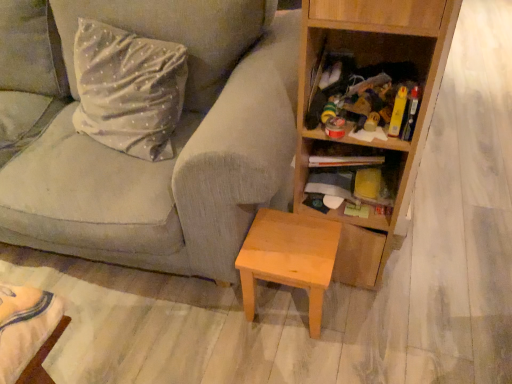
Question: Does light brown wood stool at lower center have a smaller size compared to wooden shelf at center right?

Choices:
 (A) no
 (B) yes

Answer: (A)

Question: Is light brown wood stool at lower center in contact with wooden shelf at center right?

Choices:
 (A) yes
 (B) no

Answer: (B)

Question: From a real-world perspective, is light brown wood stool at lower center over wooden shelf at center right?

Choices:
 (A) no
 (B) yes

Answer: (A)

Question: Is light brown wood stool at lower center not inside wooden shelf at center right?

Choices:
 (A) yes
 (B) no

Answer: (A)

Question: Considering the relative positions of light brown wood stool at lower center and wooden shelf at center right in the image provided, is light brown wood stool at lower center to the right of wooden shelf at center right from the viewer's perspective?

Choices:
 (A) yes
 (B) no

Answer: (B)

Question: Is light brown wood stool at lower center shorter than wooden shelf at center right?

Choices:
 (A) yes
 (B) no

Answer: (B)

Question: Does wooden bookcase at right turn towards wooden shelf at center right?

Choices:
 (A) no
 (B) yes

Answer: (B)

Question: Is wooden bookcase at right closer to camera compared to wooden shelf at center right?

Choices:
 (A) no
 (B) yes

Answer: (B)

Question: Can you confirm if wooden bookcase at right is shorter than wooden shelf at center right?

Choices:
 (A) yes
 (B) no

Answer: (B)

Question: Is the position of wooden bookcase at right more distant than that of wooden shelf at center right?

Choices:
 (A) no
 (B) yes

Answer: (A)

Question: Is wooden bookcase at right directly adjacent to wooden shelf at center right?

Choices:
 (A) no
 (B) yes

Answer: (A)

Question: From a real-world perspective, is wooden bookcase at right physically above wooden shelf at center right?

Choices:
 (A) yes
 (B) no

Answer: (A)

Question: From a real-world perspective, is wooden shelf at center right beneath textured gray fabric couch at center?

Choices:
 (A) no
 (B) yes

Answer: (B)